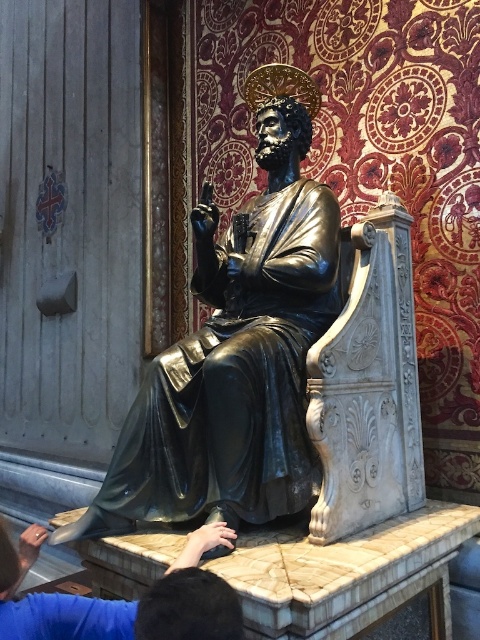
Based on the scene description, where is the shiny bronze statue at center located in terms of its 2D coordinates?

The shiny bronze statue at center is located at the 2D coordinates of point (237, 348).